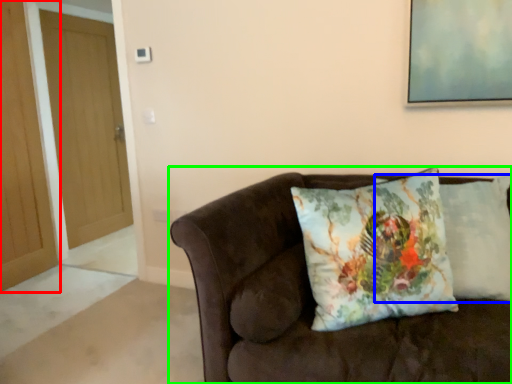
Question: Based on their relative distances, which object is nearer to door (highlighted by a red box)? Choose from pillow (highlighted by a blue box) and studio couch (highlighted by a green box).

Choices:
 (A) pillow
 (B) studio couch

Answer: (B)